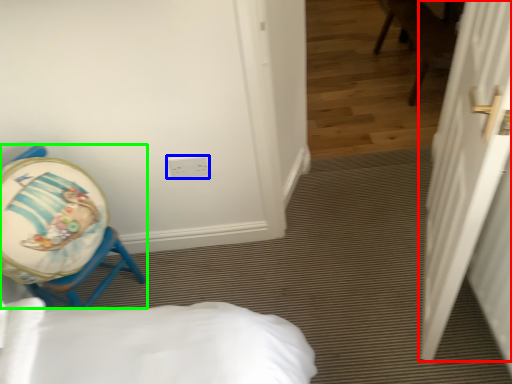
Question: Which object is positioned farthest from door (highlighted by a red box)? Select from electric outlet (highlighted by a blue box) and chair (highlighted by a green box).

Choices:
 (A) electric outlet
 (B) chair

Answer: (B)